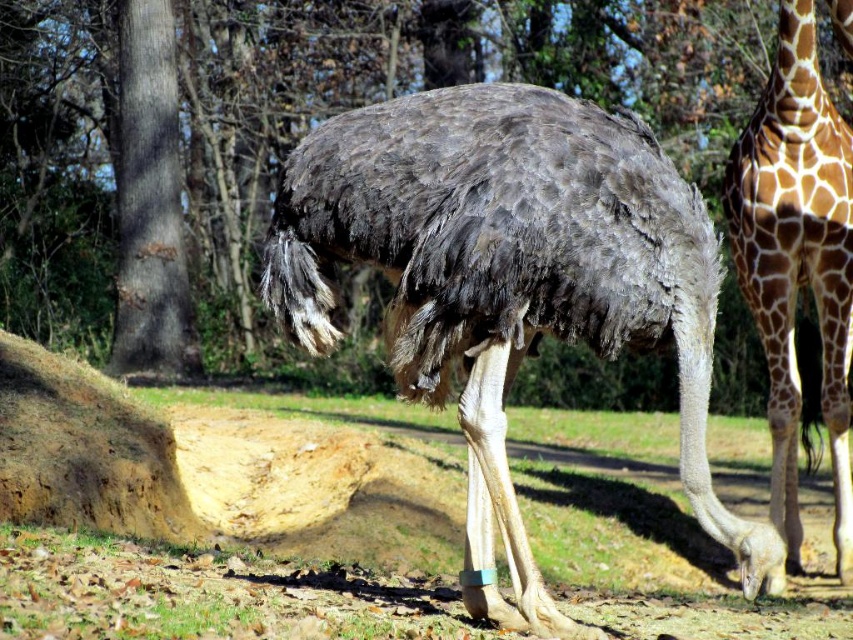
Looking at this image, you are a zookeeper observing the gray feathered ostrich at center and the gray rough bark tree at center. Which one is taller?

The gray rough bark tree at center is taller than the gray feathered ostrich at center.

You are a zookeeper observing the gray feathered ostrich at center and the gray rough bark tree at center in the enclosure. Which object is closer to the ground?

The gray feathered ostrich at center is closer to the ground than the gray rough bark tree at center because the ostrich is positioned under the tree.

You are standing at the center of the image and want to walk towards the point that is closer to you. Which point should you walk towards, point (561, 200) or point (770, 372)?

Point (561, 200) is in front of point (770, 372), so you should walk towards point (561, 200) as it is closer to you.